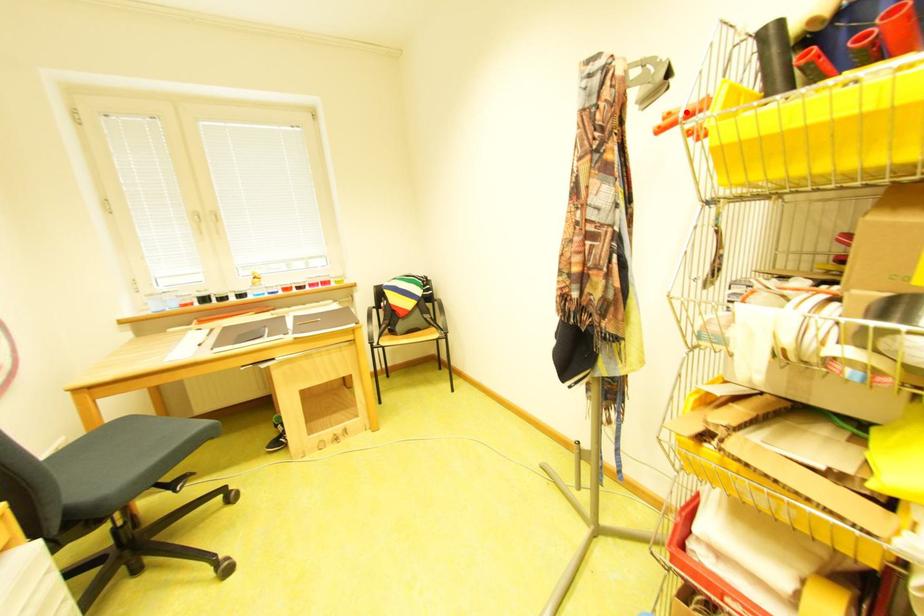
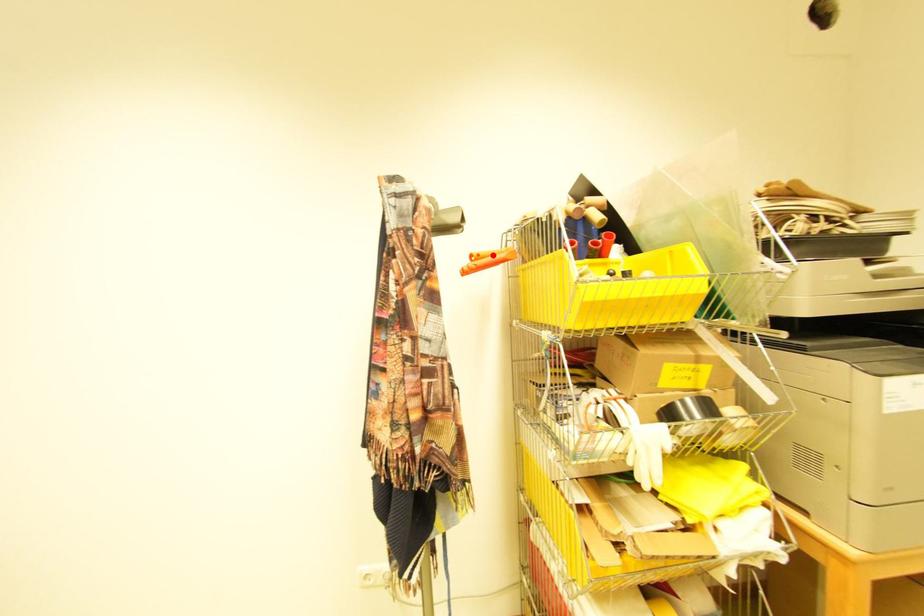
I am providing you with two images of the same scene from different viewpoints. A red point is marked on the first image and another point is marked on the second image. Is the marked point in image1 the same physical position as the marked point in image2?

Yes